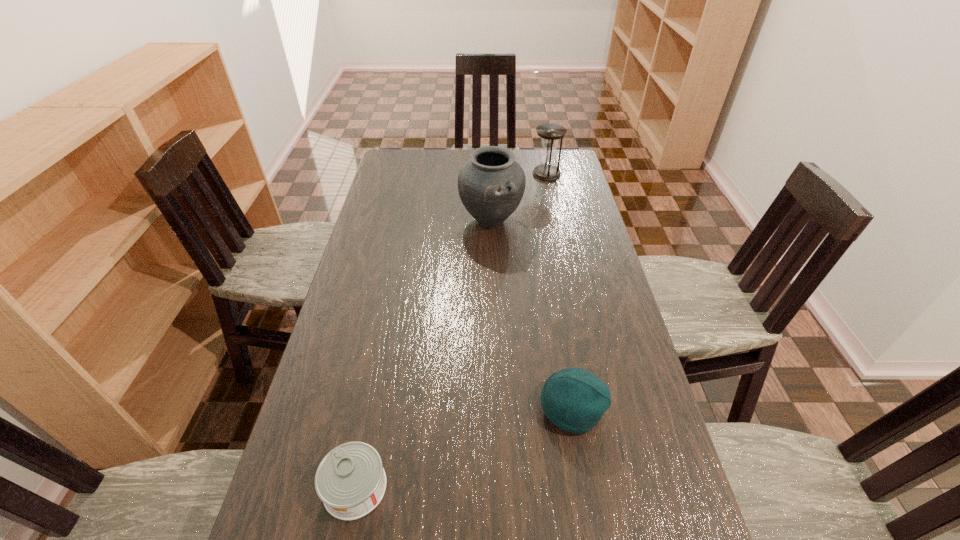
You are a GUI agent. You are given a task and a screenshot of the screen. Output one action in this format:
    pyautogui.click(x=<x>, y=<y>)
    Task: Click on the second farthest object
    
    Given the screenshot: What is the action you would take?
    pyautogui.click(x=491, y=184)

Identify the location of urn. coord(491,184).

Where is `the farthest object`? the farthest object is located at coordinates (550, 134).

This screenshot has height=540, width=960. What are the coordinates of `the third shortest object` in the screenshot? It's located at coord(550,134).

I want to click on the second shortest object, so click(x=573, y=399).

Identify the location of beanie. (573, 399).

Locate an element on the screen. The width and height of the screenshot is (960, 540). the leftmost object is located at coordinates (350, 480).

Locate an element on the screen. the nearest object is located at coordinates (350, 480).

Locate an element on the screen. This screenshot has height=540, width=960. vacant point located 0.180m on the back of the tallest object is located at coordinates (490, 178).

Locate an element on the screen. The height and width of the screenshot is (540, 960). vacant area situated 0.130m on the back of the hourglass is located at coordinates (541, 152).